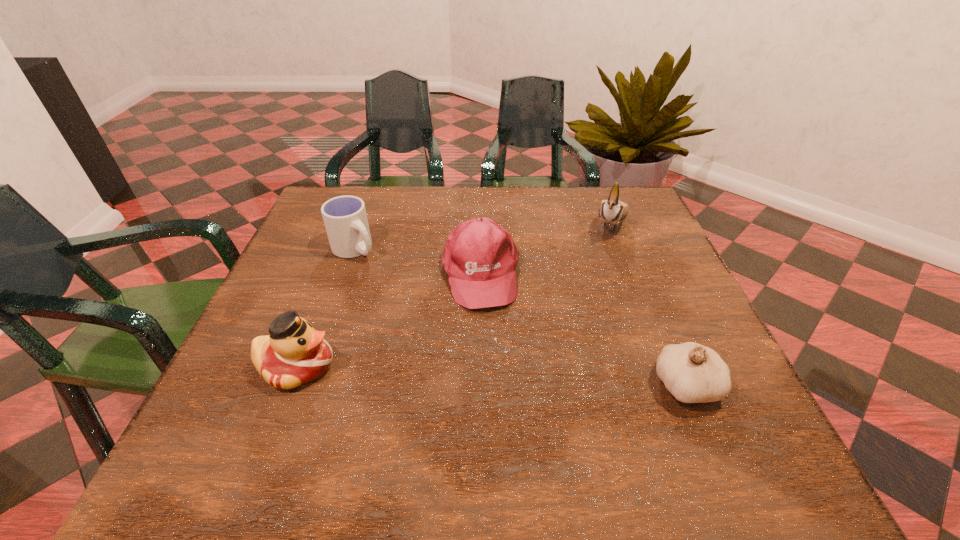
I want to click on vacant space on the desktop that is between the duck and the garlic and is positioned with the handle on the side of the cup, so click(489, 376).

The image size is (960, 540). I want to click on free space on the desktop that is between the duck and the garlic and is positioned at the front of the baseball cap with the brim, so click(x=502, y=377).

Find the location of a particular element. free spot on the desktop that is between the duck and the garlic and is positioned at the face of the bird is located at coordinates (546, 379).